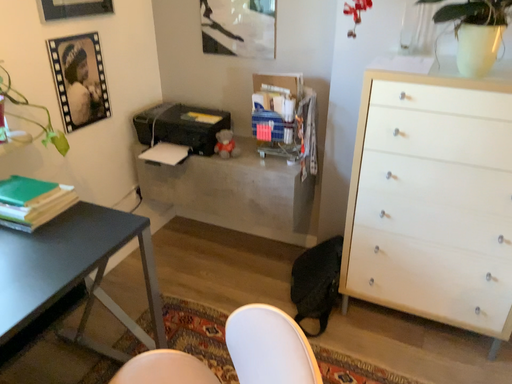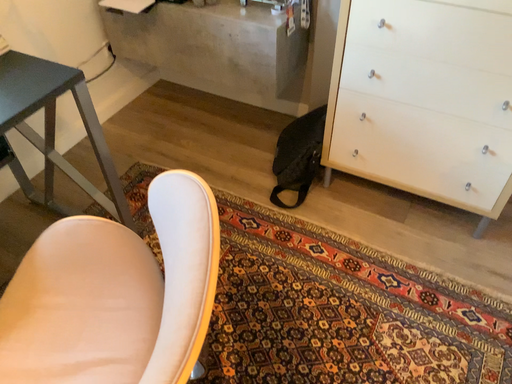
Question: Which way did the camera rotate in the video?

Choices:
 (A) rotated downward
 (B) rotated upward

Answer: (A)